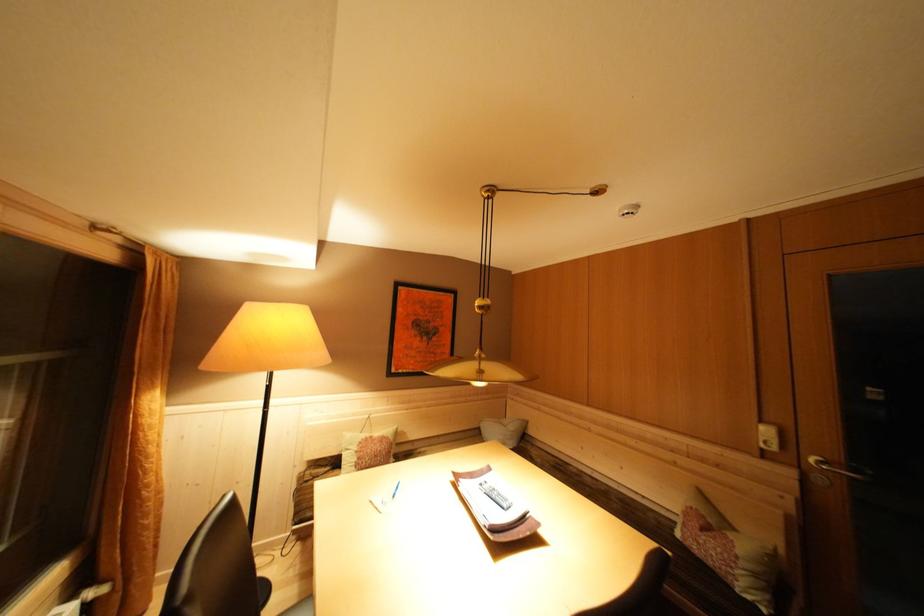
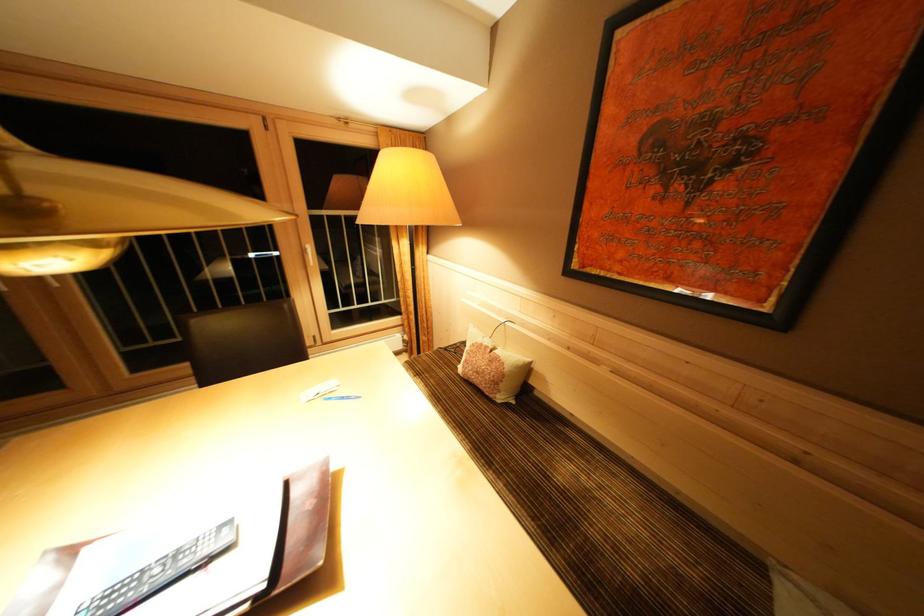
The point at (378, 442) is marked in the first image. Where is the corresponding point in the second image?

(493, 352)